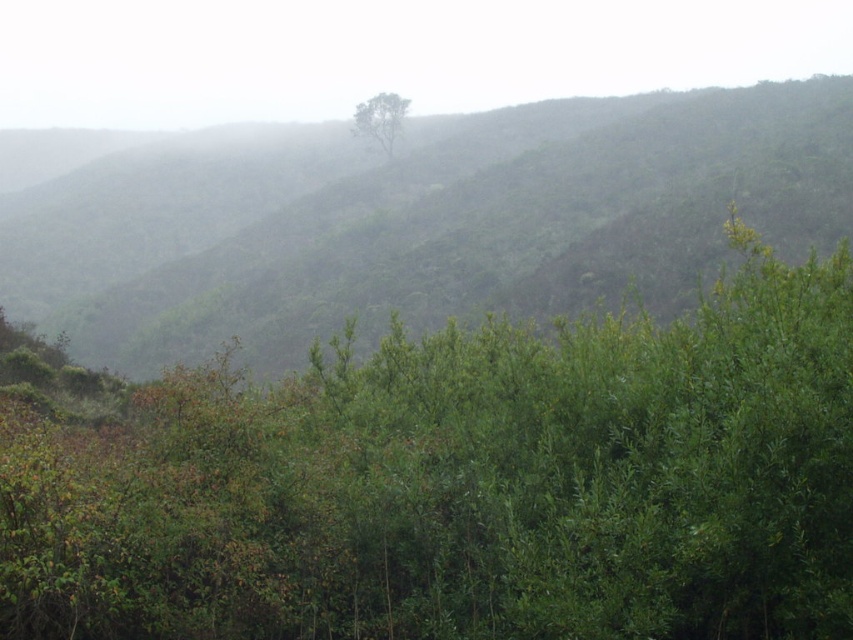
You are a hiker trying to reach the summit of the green leafy hillside at center. You see the green leafy tree at center blocking your path. Is the tree in front of or behind the hillside?

The green leafy tree at center is below green leafy hillside at center, so the tree is behind the hillside. Therefore, the tree is not blocking your path and is behind the hillside.

You are an environmental researcher studying the spatial distribution of trees in this misty hilly landscape. You observe the green leafy tree at center and the green leafy tree at upper center. Which tree has a smaller width?

The green leafy tree at center has a lesser width compared to the green leafy tree at upper center.